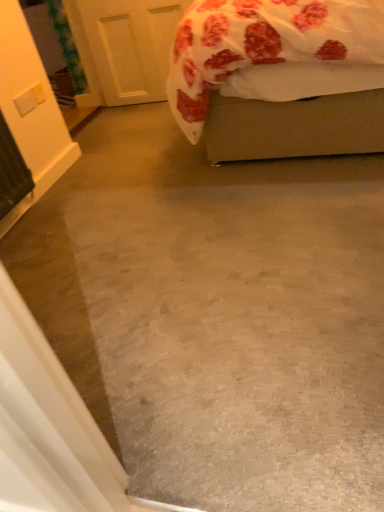
In order to click on white matte door at upper left in this screenshot , I will do `click(125, 46)`.

The height and width of the screenshot is (512, 384). Describe the element at coordinates (125, 46) in the screenshot. I see `white matte door at upper left` at that location.

Describe the element at coordinates (275, 64) in the screenshot. I see `fluffy white bed at upper right` at that location.

This screenshot has width=384, height=512. What are the coordinates of `fluffy white bed at upper right` in the screenshot? It's located at (275, 64).

This screenshot has height=512, width=384. I want to click on white matte door at upper left, so click(125, 46).

Based on the photo, is fluffy white bed at upper right to the left or to the right of white matte door at upper left in the image?

In the image, fluffy white bed at upper right appears on the right side of white matte door at upper left.

Which object is closer to the camera, fluffy white bed at upper right or white matte door at upper left?

Positioned in front is fluffy white bed at upper right.

Which is in front, point (324, 128) or point (111, 60)?

The point (324, 128) is closer.

From the image's perspective, is fluffy white bed at upper right above white matte door at upper left?

No.

From the picture: From a real-world perspective, which is physically above, fluffy white bed at upper right or white matte door at upper left?

From a 3D spatial view, fluffy white bed at upper right is above.

Which object is wider, fluffy white bed at upper right or white matte door at upper left?

Wider between the two is fluffy white bed at upper right.

Who is taller, fluffy white bed at upper right or white matte door at upper left?

fluffy white bed at upper right.

Can you confirm if fluffy white bed at upper right is smaller than white matte door at upper left?

No.

Looking at this image, is fluffy white bed at upper right not within white matte door at upper left?

Yes, fluffy white bed at upper right is not within white matte door at upper left.

Is fluffy white bed at upper right not near white matte door at upper left?

Absolutely, fluffy white bed at upper right is distant from white matte door at upper left.

Is fluffy white bed at upper right aimed at white matte door at upper left?

Yes, fluffy white bed at upper right is aimed at white matte door at upper left.

What's the angular difference between fluffy white bed at upper right and white matte door at upper left's facing directions?

90.9 degrees.

Where is `bed in front of the white matte door at upper left`? The image size is (384, 512). bed in front of the white matte door at upper left is located at coordinates (275, 64).

Considering the relative positions of white matte door at upper left and fluffy white bed at upper right in the image provided, is white matte door at upper left to the right of fluffy white bed at upper right from the viewer's perspective?

No, white matte door at upper left is not to the right of fluffy white bed at upper right.

Which object is closer to the camera taking this photo, white matte door at upper left or fluffy white bed at upper right?

Answer: fluffy white bed at upper right is closer to the camera.

Between point (136, 49) and point (367, 135), which one is positioned in front?

Point (367, 135)

From the image's perspective, would you say white matte door at upper left is positioned over fluffy white bed at upper right?

Yes, from the image's perspective, white matte door at upper left is over fluffy white bed at upper right.

From a real-world perspective, who is located higher, white matte door at upper left or fluffy white bed at upper right?

fluffy white bed at upper right is physically above.

Looking at their sizes, would you say white matte door at upper left is wider or thinner than fluffy white bed at upper right?

white matte door at upper left is thinner than fluffy white bed at upper right.

Who is taller, white matte door at upper left or fluffy white bed at upper right?

fluffy white bed at upper right.

In the scene shown: Can you confirm if white matte door at upper left is smaller than fluffy white bed at upper right?

Correct, white matte door at upper left occupies less space than fluffy white bed at upper right.

Would you say white matte door at upper left is inside or outside fluffy white bed at upper right?

white matte door at upper left is spatially situated outside fluffy white bed at upper right.

Is white matte door at upper left next to fluffy white bed at upper right?

No, white matte door at upper left is not making contact with fluffy white bed at upper right.

Does white matte door at upper left turn towards fluffy white bed at upper right?

No, white matte door at upper left is not turned towards fluffy white bed at upper right.

What's the angular difference between white matte door at upper left and fluffy white bed at upper right's facing directions?

white matte door at upper left and fluffy white bed at upper right are facing 90.9 degrees away from each other.

The height and width of the screenshot is (512, 384). I want to click on bed that is below the white matte door at upper left (from the image's perspective), so click(x=275, y=64).

Identify the location of bed lying below the white matte door at upper left (from the image's perspective). (275, 64).

The image size is (384, 512). Identify the location of door lying above the fluffy white bed at upper right (from the image's perspective). (125, 46).